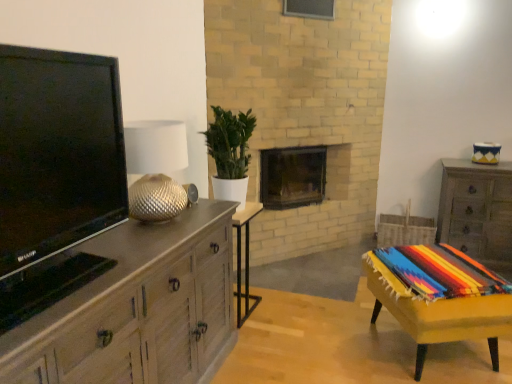
Question: Is dark brown wood fireplace at center wider than yellow fabric-covered table at lower right, the first table viewed from the right?

Choices:
 (A) no
 (B) yes

Answer: (A)

Question: Is dark brown wood fireplace at center turned away from yellow fabric-covered table at lower right, the second table when ordered from left to right?

Choices:
 (A) yes
 (B) no

Answer: (B)

Question: Is dark brown wood fireplace at center not inside yellow fabric-covered table at lower right, the first table viewed from the right?

Choices:
 (A) yes
 (B) no

Answer: (A)

Question: Considering the relative positions of dark brown wood fireplace at center and yellow fabric-covered table at lower right, the first table viewed from the right, in the image provided, is dark brown wood fireplace at center behind yellow fabric-covered table at lower right, the first table viewed from the right,?

Choices:
 (A) no
 (B) yes

Answer: (B)

Question: Considering the relative sizes of dark brown wood fireplace at center and yellow fabric-covered table at lower right, the first table viewed from the right, in the image provided, is dark brown wood fireplace at center shorter than yellow fabric-covered table at lower right, the first table viewed from the right,?

Choices:
 (A) no
 (B) yes

Answer: (A)

Question: In the image, is light wood/wooden chest of drawers at left, the 1th chest of drawers positioned from the front, on the left side or the right side of gold textured lampshade at left?

Choices:
 (A) left
 (B) right

Answer: (A)

Question: Is point (230, 276) positioned closer to the camera than point (130, 201)?

Choices:
 (A) closer
 (B) farther

Answer: (B)

Question: Is light wood/wooden chest of drawers at left, which ranks as the 2th chest of drawers in right-to-left order, inside the boundaries of gold textured lampshade at left, or outside?

Choices:
 (A) inside
 (B) outside

Answer: (B)

Question: Looking at their shapes, would you say light wood/wooden chest of drawers at left, which is the 2th chest of drawers in back-to-front order, is wider or thinner than gold textured lampshade at left?

Choices:
 (A) thin
 (B) wide

Answer: (B)

Question: Considering their positions, is gold textured lampshade at left located in front of or behind wooden side table at center, the first table from the left?

Choices:
 (A) behind
 (B) front

Answer: (B)

Question: Based on their positions, is gold textured lampshade at left located to the left or right of wooden side table at center, which is the second table from right to left?

Choices:
 (A) right
 (B) left

Answer: (B)

Question: Is point (152, 142) positioned closer to the camera than point (240, 228)?

Choices:
 (A) farther
 (B) closer

Answer: (B)

Question: Looking at their shapes, would you say gold textured lampshade at left is wider or thinner than wooden side table at center, the first table from the left?

Choices:
 (A) thin
 (B) wide

Answer: (B)

Question: From a real-world perspective, is wooden side table at center, which is the second table from right to left, positioned above or below matte black tv at left?

Choices:
 (A) below
 (B) above

Answer: (A)

Question: In terms of size, does wooden side table at center, the first table from the left, appear bigger or smaller than matte black tv at left?

Choices:
 (A) big
 (B) small

Answer: (B)